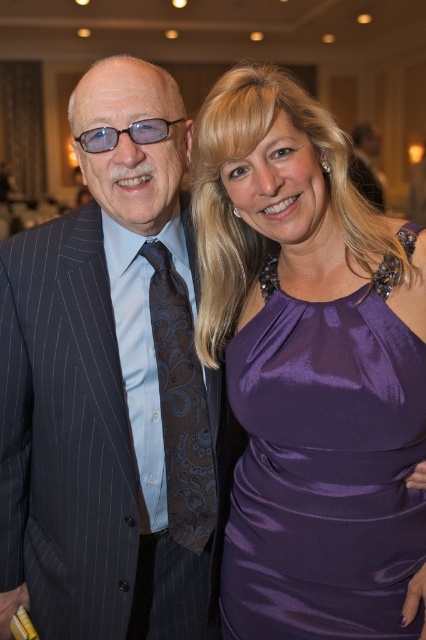
In the image, there are two people posing together. The man is wearing a dark pinstriped suit on the left, and the woman is wearing a sleeveless purple satin dress at right. A point labeled as point (325, 467) is marked in the image. Which object does this point correspond to?

The point (325, 467) corresponds to the satin purple dress at right.

You are a photographer adjusting the focus on a camera. The camera has a focus point at the coordinates point [325,467]. Based on the scene, which object is at that focus point?

The point [325,467] is on the satin purple dress at right.